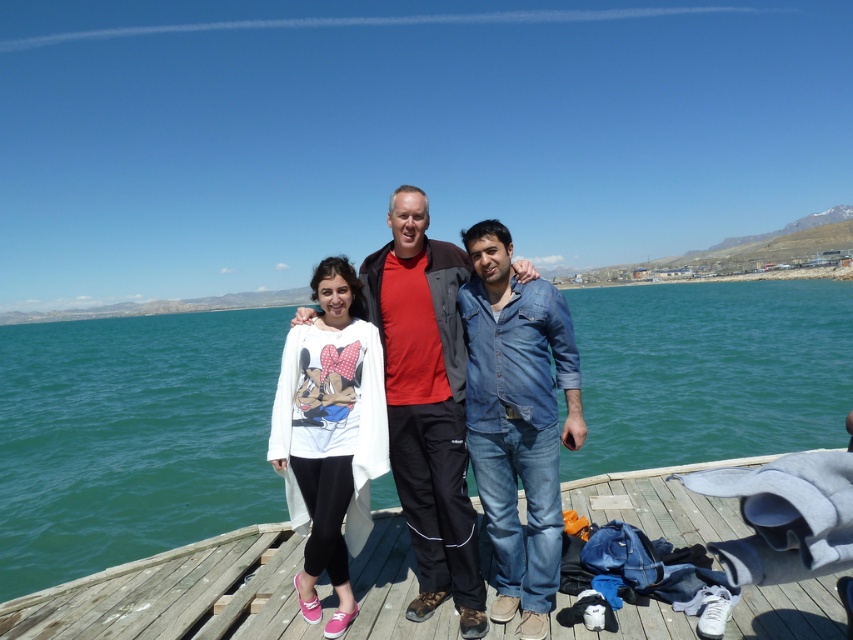
Between wooden at center and white matte shirt at center, which one is positioned lower?

Positioned lower is wooden at center.

Who is more distant from viewer, (572, 504) or (300, 500)?

The point (572, 504) is more distant.

This screenshot has width=853, height=640. I want to click on wooden at center, so coord(175,595).

Is red cotton shirt at center smaller than white matte shirt at center?

Indeed, red cotton shirt at center has a smaller size compared to white matte shirt at center.

Does point (451, 570) come farther from viewer compared to point (282, 419)?

No, it is in front of (282, 419).

The height and width of the screenshot is (640, 853). Find the location of `red cotton shirt at center`. red cotton shirt at center is located at coordinates (427, 403).

Which is behind, point (521, 346) or point (376, 468)?

Positioned behind is point (521, 346).

Does denim jeans at lower right have a larger size compared to white matte shirt at center?

Actually, denim jeans at lower right might be smaller than white matte shirt at center.

Between point (503, 278) and point (364, 509), which one is positioned behind?

Point (503, 278)

You are a GUI agent. You are given a task and a screenshot of the screen. Output one action in this format:
    pyautogui.click(x=<x>, y=<y>)
    Task: Click on the denim jeans at lower right
    
    Given the screenshot: What is the action you would take?
    pyautogui.click(x=517, y=419)